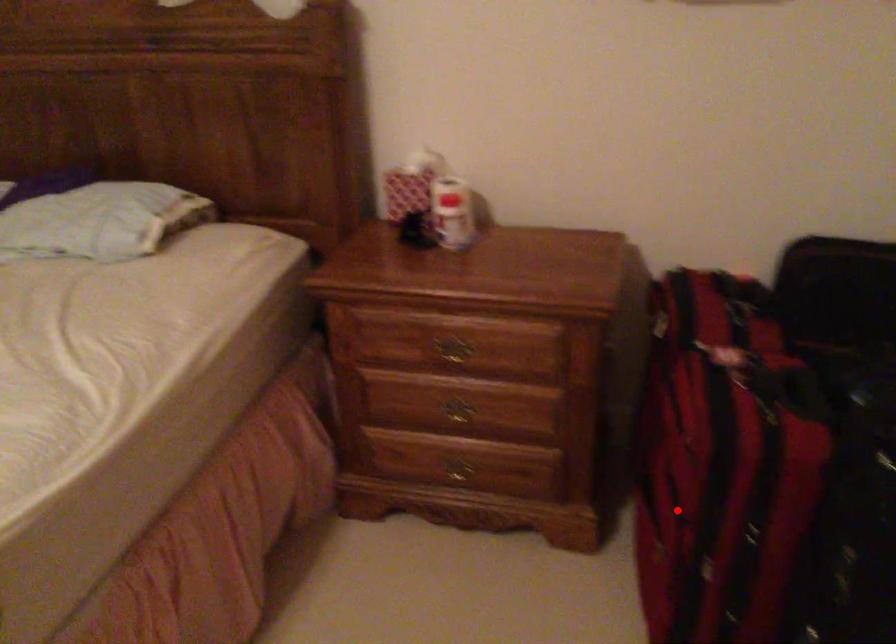
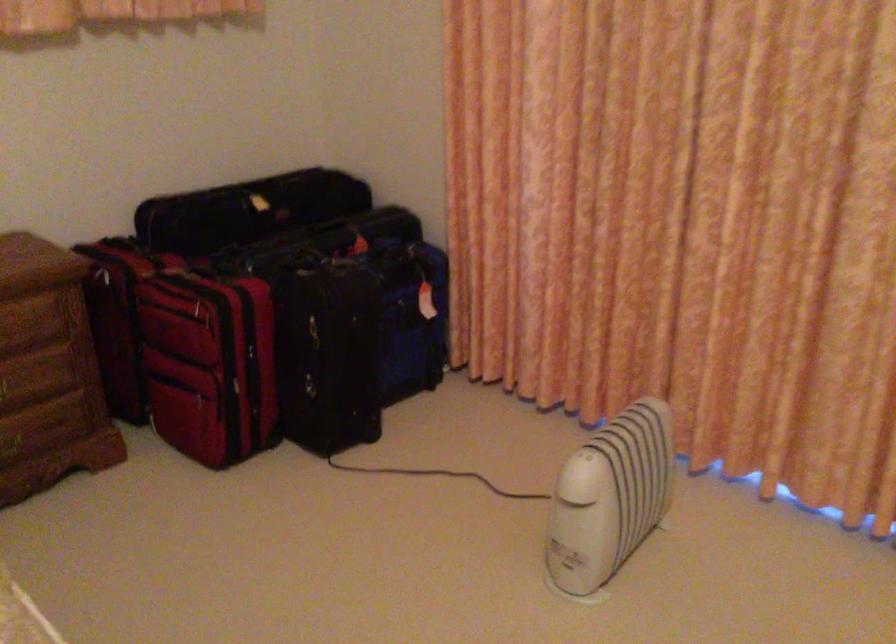
Find the pixel in the second image that matches the highlighted location in the first image.

(209, 364)